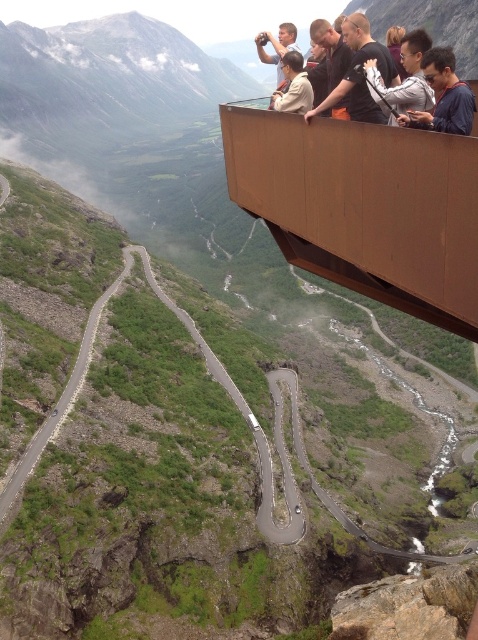
You are standing on the brown wood balcony at upper center. What are the coordinates of your current position?

The coordinates of the brown wood balcony at upper center are point (365,208).

You are standing on the wooden observation platform and want to take a photo of the dark blue shirt at upper right and the matte black jacket at upper center. Which of these two people is standing more to your right side?

The dark blue shirt at upper right is positioned on the right side of matte black jacket at upper center, so the person wearing the dark blue shirt at upper right is standing more to your right side.

You are standing on the wooden observation platform and want to take a photo of the dark blue shirt at upper right. Where should you position yourself to ensure the shirt is centered in your camera frame?

To center the dark blue shirt at upper right in your camera frame, position yourself so the shirt is at the point corresponding to coordinates 0.152 on the horizontal axis and 0.929 on the vertical axis relative to the image plane.